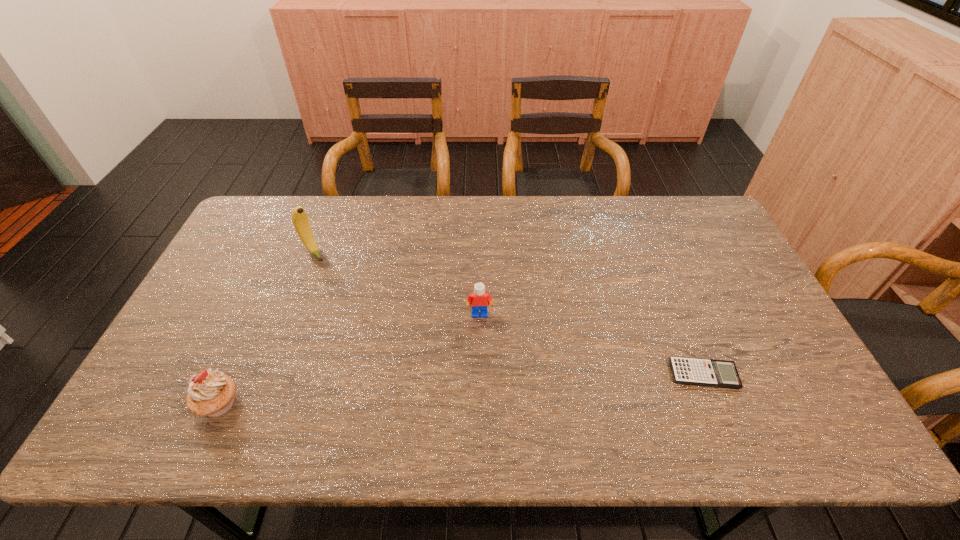
Where is `cupcake`? Image resolution: width=960 pixels, height=540 pixels. cupcake is located at coordinates (211, 393).

Where is `the rightmost object`? the rightmost object is located at coordinates (693, 371).

I want to click on calculator, so click(x=693, y=371).

Where is `Lego`? Lego is located at coordinates (479, 300).

This screenshot has width=960, height=540. Find the location of `the second farthest object`. the second farthest object is located at coordinates (479, 300).

The height and width of the screenshot is (540, 960). Identify the location of the farthest object. (300, 219).

Locate an element on the screen. The width and height of the screenshot is (960, 540). the tallest object is located at coordinates (300, 219).

Identify the location of free space located 0.200m on the right of the cupcake. Image resolution: width=960 pixels, height=540 pixels. (324, 403).

Image resolution: width=960 pixels, height=540 pixels. Find the location of `blank space located 0.100m on the back of the shortest object`. blank space located 0.100m on the back of the shortest object is located at coordinates (685, 328).

I want to click on free space located on the face of the second farthest object, so click(x=481, y=341).